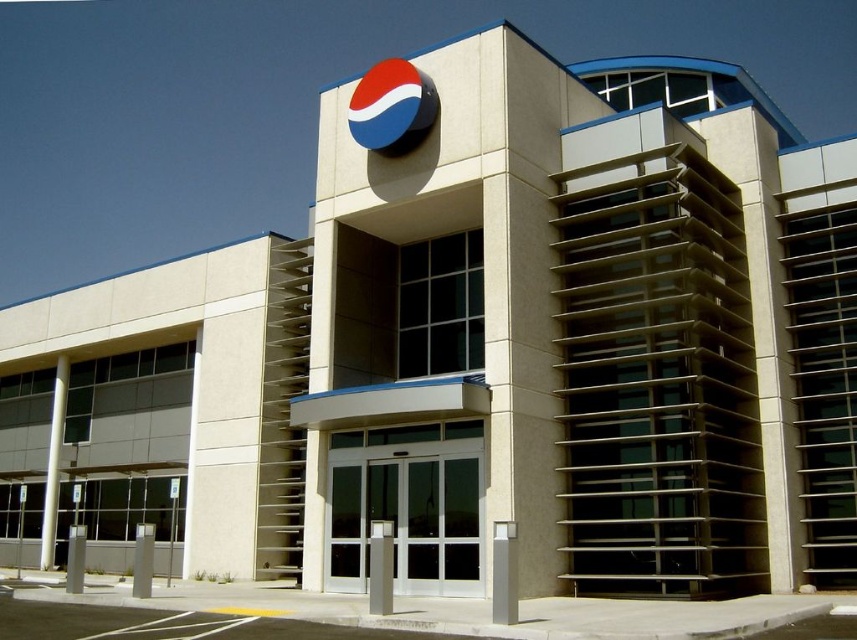
You are a delivery person trying to park your 8 feet wide truck in front of the building. The truck needs to be positioned between the white glossy pillar at center and the satin silver post at center. Is there enough space for the truck to fit between them?

The white glossy pillar at center and satin silver post at center are 7.73 feet apart, so the truck which is 8 feet wide cannot fit between them as the space is narrower than the truck.